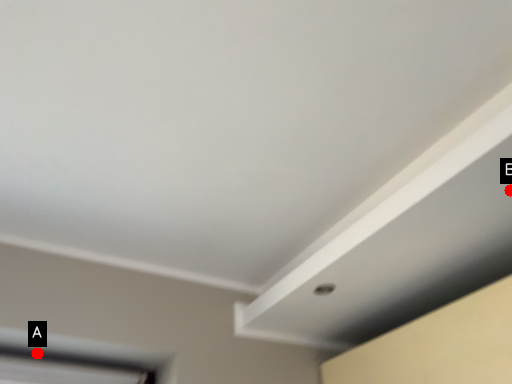
Question: Two points are circled on the image, labeled by A and B beside each circle. Which point is farther to the camera?

Choices:
 (A) A is further
 (B) B is further

Answer: (A)